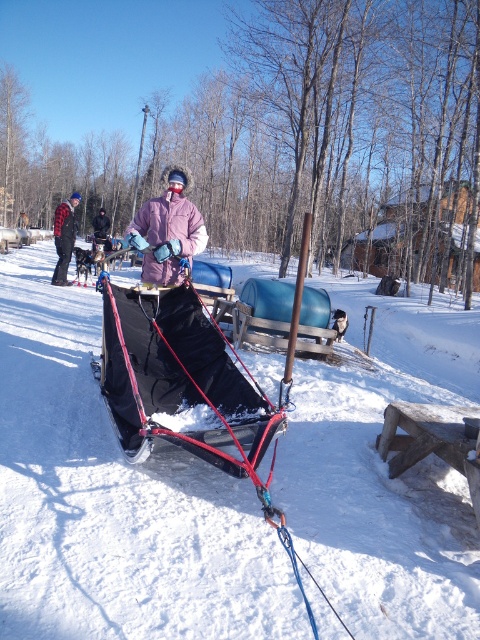
Who is more distant from viewer, (81,536) or (96,228)?

Positioned behind is point (96,228).

Is point (244, 538) in front of point (108, 227)?

Yes, point (244, 538) is in front of point (108, 227).

Locate an element on the screen. This screenshot has height=640, width=480. white matte snow at center is located at coordinates (112, 499).

Between white matte snow at center and brushed metal jacket at left, which one appears on the right side from the viewer's perspective?

white matte snow at center is more to the right.

Between point (26, 502) and point (69, 256), which one is positioned behind?

Point (69, 256)

Locate an element on the screen. The image size is (480, 640). white matte snow at center is located at coordinates (112, 499).

Measure the distance between pink fuzzy jacket at center and brushed metal jacket at left.

11.91 meters

Is pink fuzzy jacket at center to the left of brushed metal jacket at left from the viewer's perspective?

No, pink fuzzy jacket at center is not to the left of brushed metal jacket at left.

Is point (154, 275) farther from camera compared to point (55, 280)?

No, (154, 275) is closer to viewer.

Where is `pink fuzzy jacket at center`? pink fuzzy jacket at center is located at coordinates 168,230.